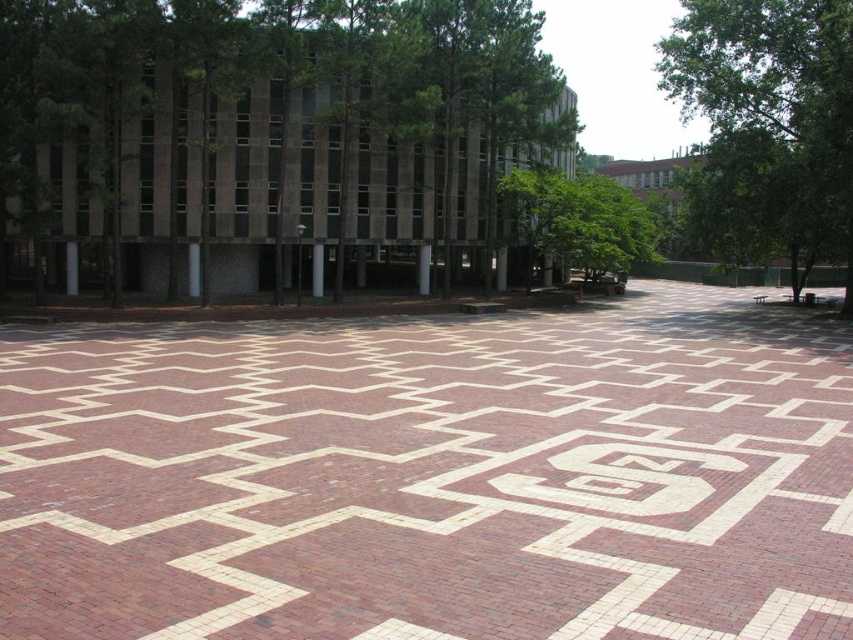
This screenshot has height=640, width=853. What do you see at coordinates (432, 476) in the screenshot?
I see `brick at center` at bounding box center [432, 476].

Which is more to the right, brick at center or green leafy tree at upper center?

brick at center

Does point (434, 364) come closer to viewer compared to point (480, 17)?

Yes, it is in front of point (480, 17).

The width and height of the screenshot is (853, 640). What are the coordinates of `brick at center` in the screenshot? It's located at (432, 476).

Does green leafy tree at upper right have a lesser width compared to green leafy tree at center?

Incorrect, green leafy tree at upper right's width is not less than green leafy tree at center's.

Measure the distance between green leafy tree at upper right and camera.

green leafy tree at upper right and camera are 26.56 meters apart from each other.

Image resolution: width=853 pixels, height=640 pixels. In order to click on green leafy tree at upper right in this screenshot , I will do `click(769, 124)`.

Is brick at center closer to camera compared to green leafy tree at center?

Yes, it is.

Does brick at center have a greater height compared to green leafy tree at center?

No.

The width and height of the screenshot is (853, 640). Identify the location of brick at center. (432, 476).